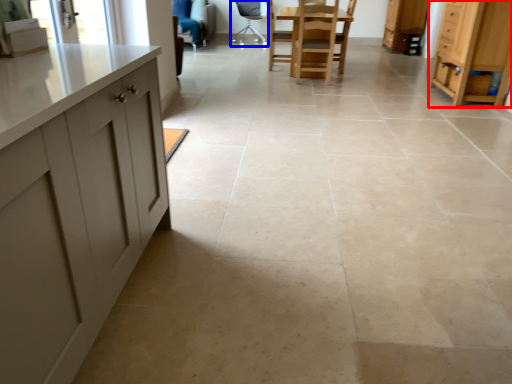
Question: Which point is further to the camera, cabinetry (highlighted by a red box) or chair (highlighted by a blue box)?

Choices:
 (A) cabinetry
 (B) chair

Answer: (B)